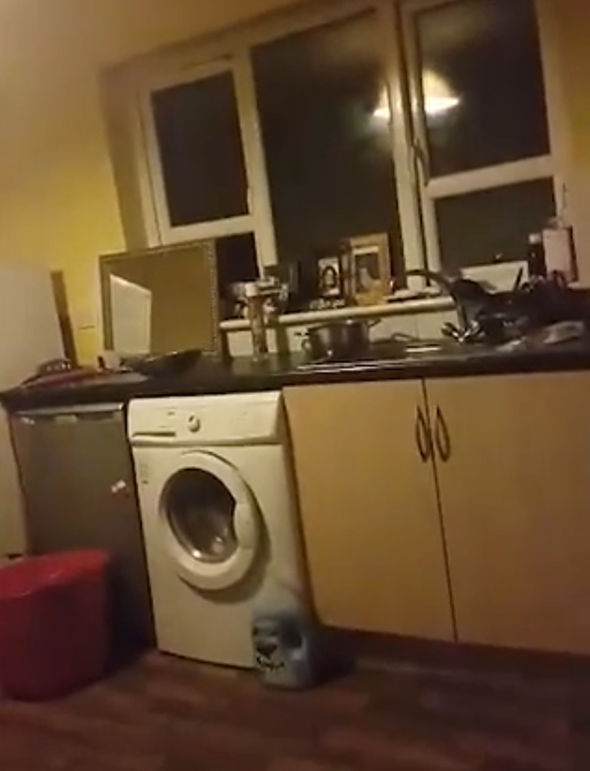
Image resolution: width=590 pixels, height=771 pixels. What are the coordinates of `pictures` in the screenshot? It's located at pyautogui.click(x=330, y=281), pyautogui.click(x=372, y=278), pyautogui.click(x=287, y=278).